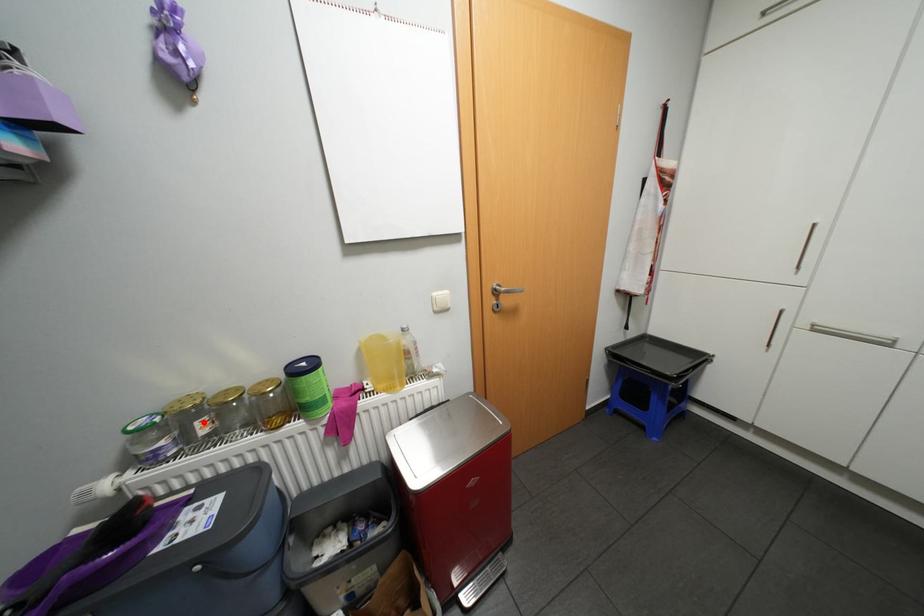
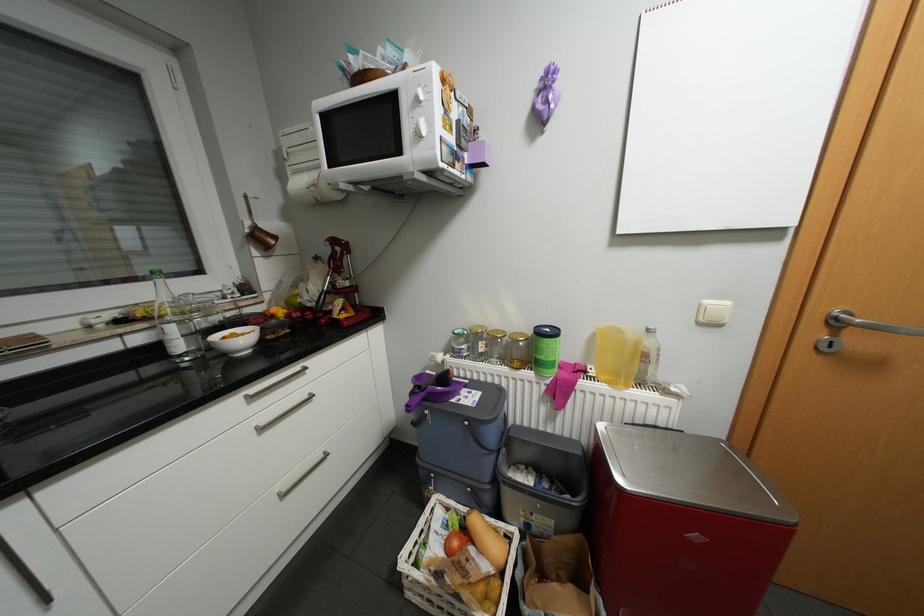
In the second image, find the point that corresponds to the highlighted location in the first image.

(488, 342)